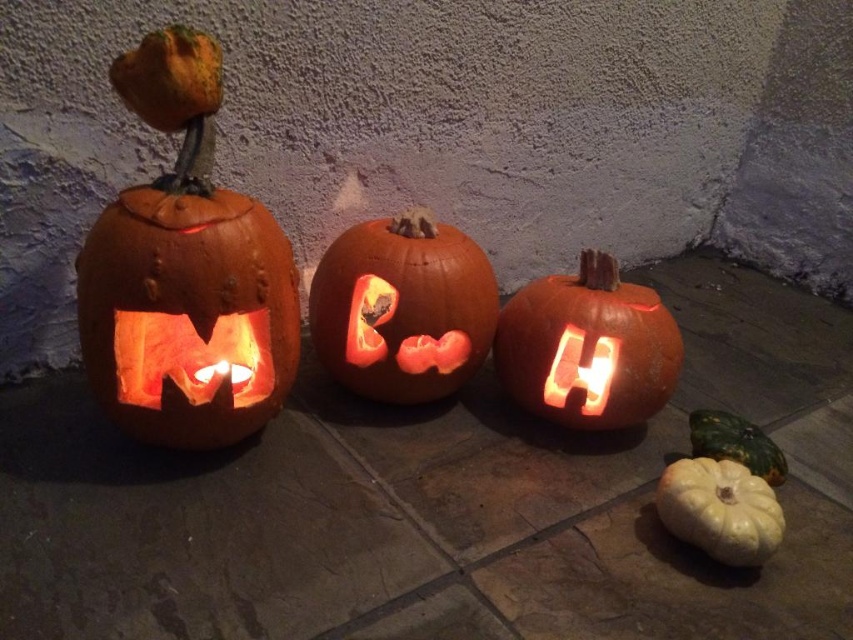
You are a delivery person who needs to place a small package on the smooth white gourd at lower right. However, there is an orange carved pumpkin at center in the way. Can you move the pumpkin to access the gourd?

The orange carved pumpkin at center is positioned over the smooth white gourd at lower right, so you cannot access the gourd without moving the pumpkin first.

You are standing at the origin point of the coordinate system. Which direction should you move to reach the carved orange pumpkin at left?

The carved orange pumpkin at left is located at coordinate point 0.427 on the x axis and 0.218 on the y axis. Since you are at the origin, you should move towards the positive x and positive y directions to reach it.

You are standing in front of the scene and want to pick up the smooth white gourd at lower right. Can you reach it without moving the orange carved pumpkin at center?

The smooth white gourd at lower right is behind the orange carved pumpkin at center, so you cannot reach it without moving the orange carved pumpkin at center first.